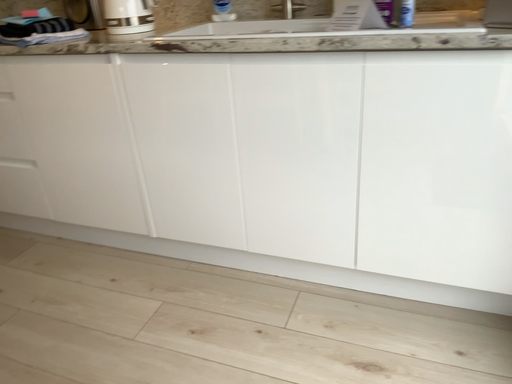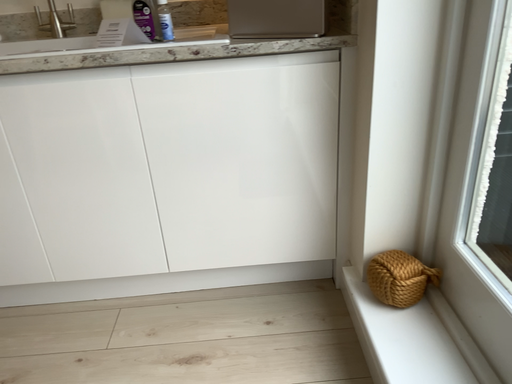
Question: How did the camera likely rotate when shooting the video?

Choices:
 (A) rotated right
 (B) rotated left

Answer: (A)